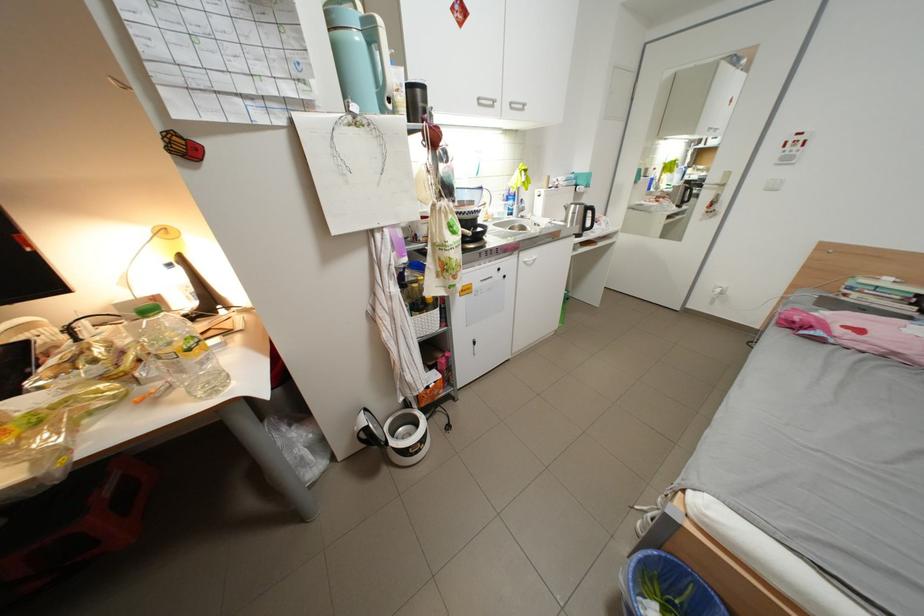
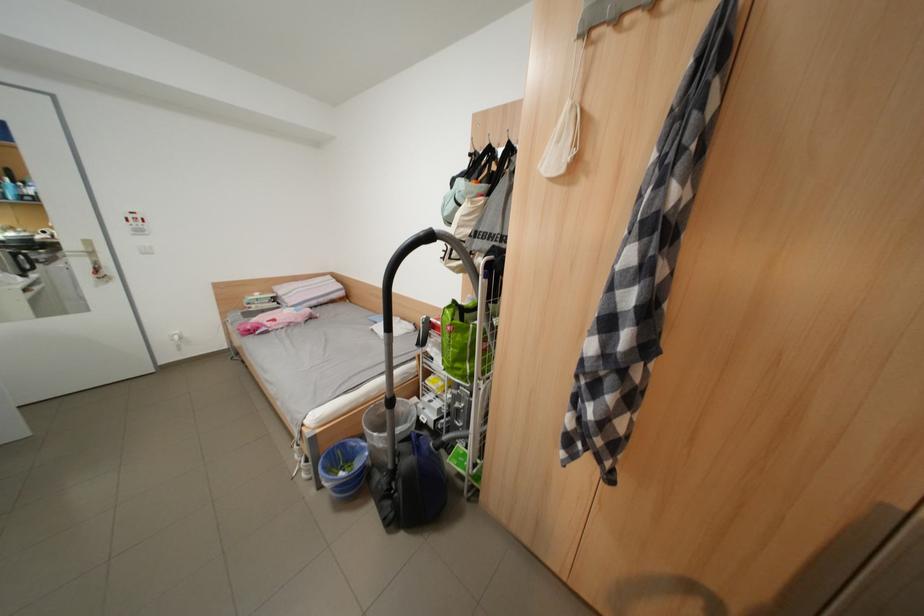
In the second image, find the point that corresponds to point (798, 161) in the first image.

(152, 233)